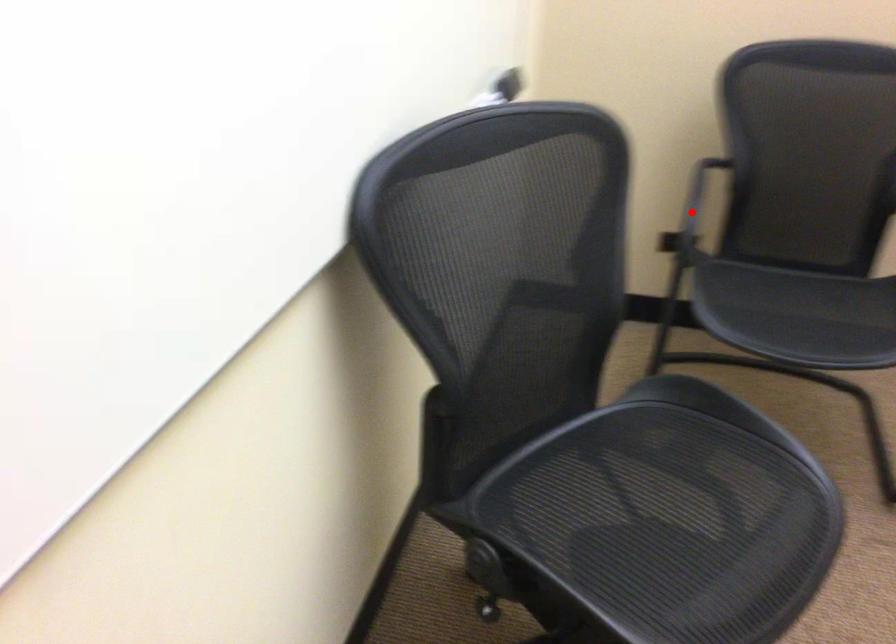
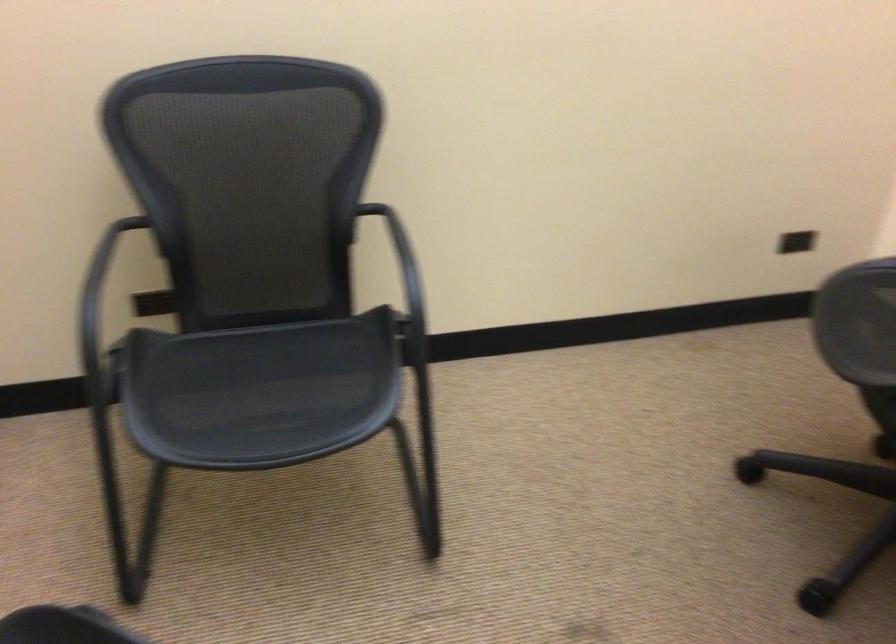
Question: I am providing you with two images of the same scene from different viewpoints. A red point is marked on the first image. Can you still see the location of the red point in image 2?

Choices:
 (A) Yes
 (B) No

Answer: (B)